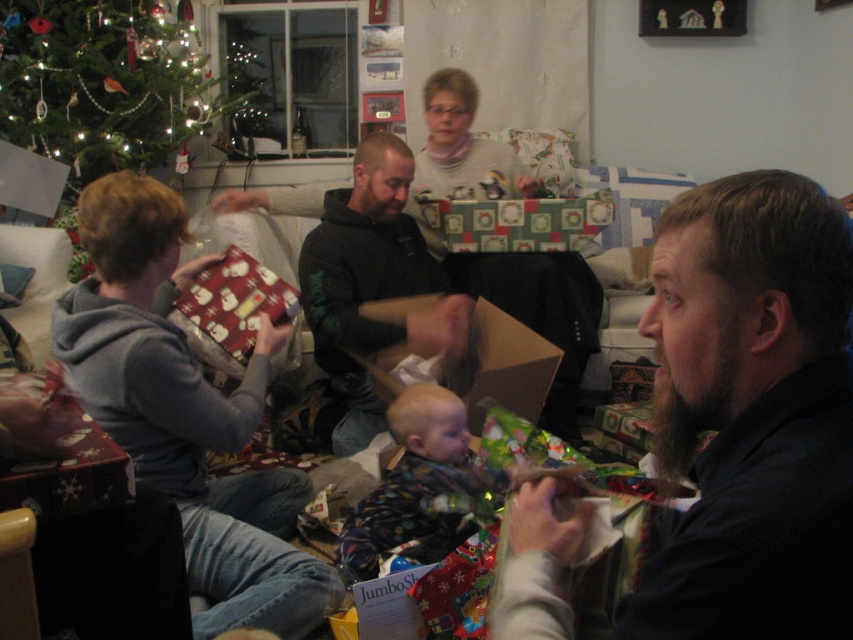
Question: Is matte gray hoodie at left further to camera compared to black soft hoodie at center?

Choices:
 (A) no
 (B) yes

Answer: (A)

Question: Observing the image, what is the correct spatial positioning of matte gray hoodie at left in reference to printed fabric baby at center?

Choices:
 (A) above
 (B) below

Answer: (A)

Question: Which object is farther from the camera taking this photo?

Choices:
 (A) black soft hoodie at center
 (B) dark brown leather jacket at center
 (C) printed fabric baby at center
 (D) matte gray hoodie at left

Answer: (A)

Question: Is dark brown leather jacket at center positioned behind black soft hoodie at center?

Choices:
 (A) no
 (B) yes

Answer: (A)

Question: Which of the following is the farthest from the observer?

Choices:
 (A) green matte christmas tree at upper left
 (B) matte gray hoodie at left
 (C) printed fabric baby at center
 (D) dark brown leather jacket at center

Answer: (A)

Question: Which of the following is the closest to the observer?

Choices:
 (A) green matte christmas tree at upper left
 (B) black soft hoodie at center
 (C) printed fabric baby at center

Answer: (C)